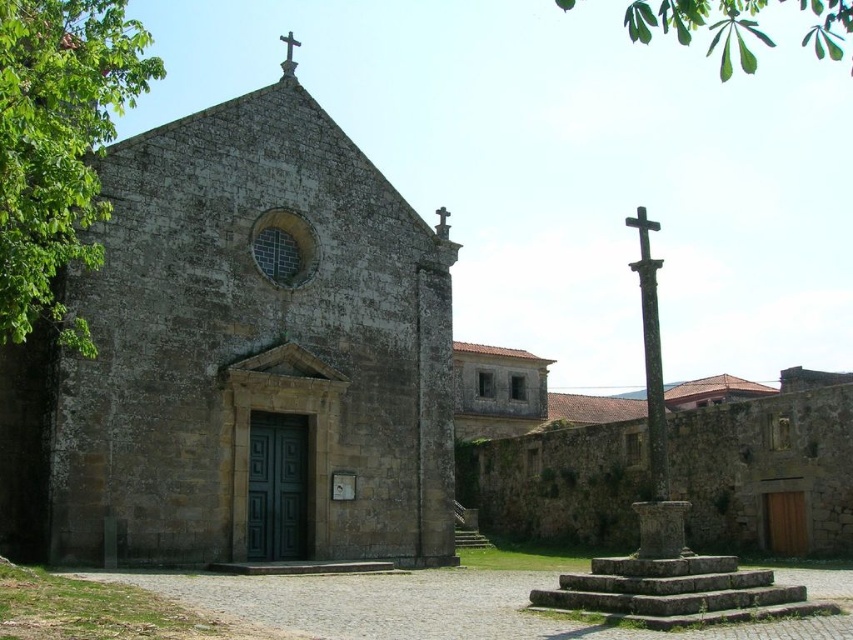
Between stone church at center and metallic cross at upper center, which one is positioned higher?

metallic cross at upper center is above.

Where is `stone church at center`? Image resolution: width=853 pixels, height=640 pixels. stone church at center is located at coordinates (244, 356).

Between black wood cross at upper right and metallic cross at upper center, which one appears on the right side from the viewer's perspective?

From the viewer's perspective, black wood cross at upper right appears more on the right side.

Does point (648, 248) lie in front of point (288, 33)?

Yes, it is in front of point (288, 33).

You are a GUI agent. You are given a task and a screenshot of the screen. Output one action in this format:
    pyautogui.click(x=<x>, y=<y>)
    Task: Click on the black wood cross at upper right
    This screenshot has height=640, width=853.
    Given the screenshot: What is the action you would take?
    pyautogui.click(x=642, y=228)

The image size is (853, 640). Describe the element at coordinates (244, 356) in the screenshot. I see `stone church at center` at that location.

What do you see at coordinates (244, 356) in the screenshot? I see `stone church at center` at bounding box center [244, 356].

The height and width of the screenshot is (640, 853). In order to click on stone church at center in this screenshot , I will do `click(244, 356)`.